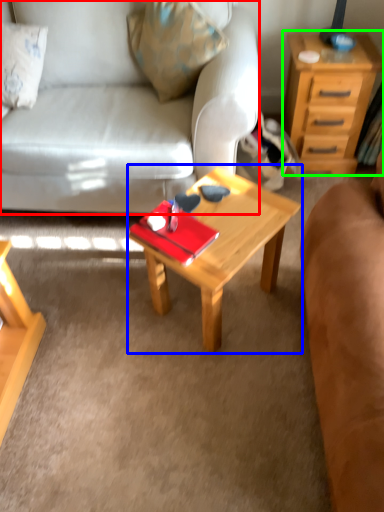
Question: Which object is the closest to the studio couch (highlighted by a red box)? Choose among these: coffee table (highlighted by a blue box) or nightstand (highlighted by a green box).

Choices:
 (A) coffee table
 (B) nightstand

Answer: (A)